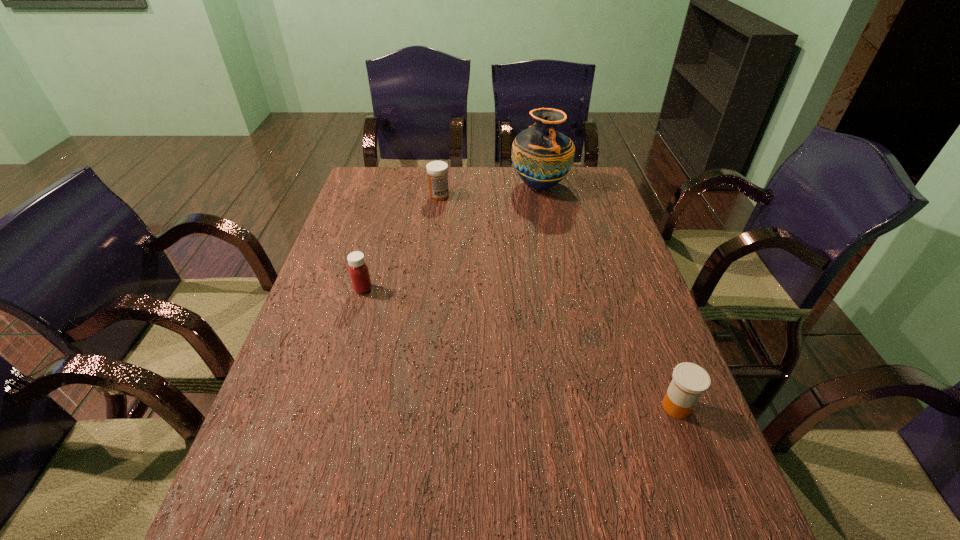
Find the location of `free space located 0.200m on the front of the second nearest medicine`. free space located 0.200m on the front of the second nearest medicine is located at coordinates (345, 355).

At what (x,y) coordinates should I click in order to perform the action: click on vacant area situated on the label of the nearest medicine. Please return your answer as a coordinate pair (x, y). Looking at the image, I should click on (509, 407).

Find the location of a particular element. The image size is (960, 540). blank space located 0.050m on the label of the nearest medicine is located at coordinates (636, 407).

The width and height of the screenshot is (960, 540). I want to click on vacant space located on the label of the nearest medicine, so click(x=613, y=407).

Find the location of a particular element. The width and height of the screenshot is (960, 540). pottery that is at the far edge is located at coordinates click(542, 156).

At what (x,y) coordinates should I click in order to perform the action: click on medicine present at the far edge. Please return your answer as a coordinate pair (x, y). The width and height of the screenshot is (960, 540). Looking at the image, I should click on (437, 171).

Find the location of a particular element. object that is at the left edge is located at coordinates (358, 269).

You are a GUI agent. You are given a task and a screenshot of the screen. Output one action in this format:
    pyautogui.click(x=<x>, y=<y>)
    Task: Click on the pottery that is at the right edge
    This screenshot has height=540, width=960.
    Given the screenshot: What is the action you would take?
    pyautogui.click(x=542, y=156)

Locate an element on the screen. medicine at the right edge is located at coordinates (689, 381).

In order to click on object at the far right corner in this screenshot , I will do `click(542, 156)`.